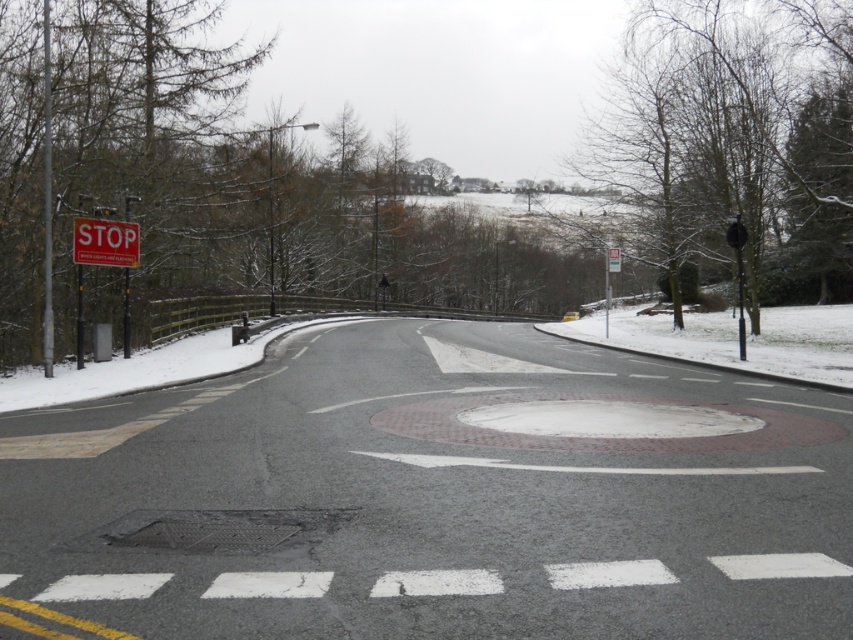
You are standing at the snowy roadside and want to take a photo of both point (137, 260) and point (613, 260) in the scene. Which point will appear larger in your photo?

Point (137, 260) will appear larger in the photo because it is closer to the camera than point (613, 260).

You are driving a car and see the red plastic stop sign at upper left and the metallic rectangular sign at upper center ahead on the road. Which sign is closer to the left edge of the road?

The red plastic stop sign at upper left is closer to the left edge of the road because it is positioned to the left of the metallic rectangular sign at upper center.